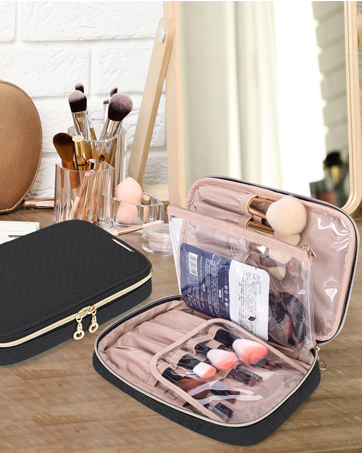
Where is `small brushes`? small brushes is located at coordinates (228, 394), (226, 400), (262, 379), (251, 377), (235, 385), (282, 362), (267, 367).